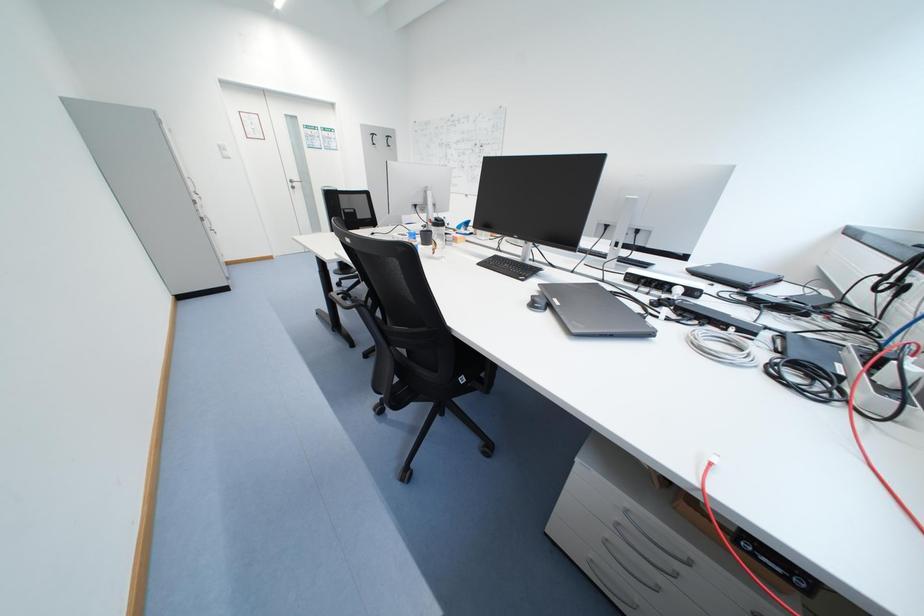
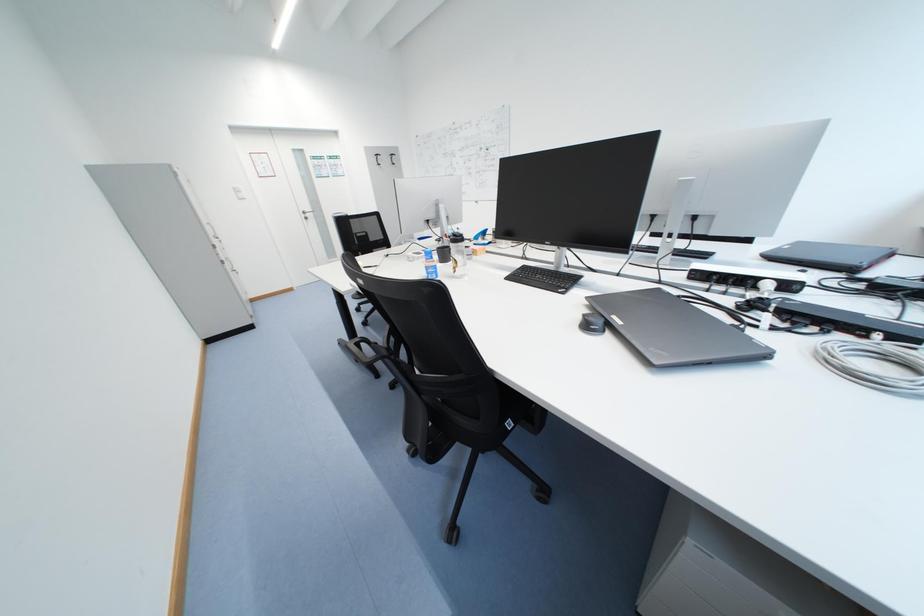
Which direction would the cameraman need to move to produce the second image?

The cameraman walked toward left, forward.